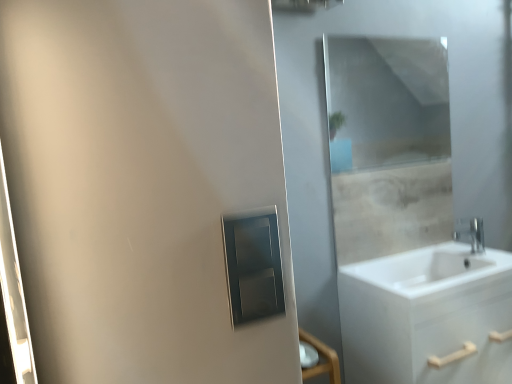
This screenshot has width=512, height=384. What are the coordinates of `silver metallic faucet at right` in the screenshot? It's located at (470, 233).

You are a GUI agent. You are given a task and a screenshot of the screen. Output one action in this format:
    pyautogui.click(x=<x>, y=<y>)
    Task: Click on the clear glass mirror at upper center
    Image resolution: width=512 pixels, height=384 pixels.
    Given the screenshot: What is the action you would take?
    [x=386, y=101]

What do you see at coordinates (253, 266) in the screenshot?
I see `matte silver medicine cabinet at center` at bounding box center [253, 266].

This screenshot has width=512, height=384. What are the coordinates of `matte silver medicine cabinet at center` in the screenshot? It's located at (253, 266).

Locate an element on the screen. The height and width of the screenshot is (384, 512). white matte cabinet at lower right is located at coordinates (428, 316).

Looking at this image, considering the relative sizes of matte silver medicine cabinet at center and silver metallic faucet at right in the image provided, is matte silver medicine cabinet at center smaller than silver metallic faucet at right?

Indeed, matte silver medicine cabinet at center has a smaller size compared to silver metallic faucet at right.

Locate an element on the screen. medicine cabinet that appears above the silver metallic faucet at right (from a real-world perspective) is located at coordinates (253, 266).

Would you say silver metallic faucet at right is part of matte silver medicine cabinet at center's contents?

No.

Considering their positions, is white matte cabinet at lower right located in front of or behind clear glass mirror at upper center?

Visually, white matte cabinet at lower right is located in front of clear glass mirror at upper center.

From the image's perspective, is white matte cabinet at lower right over clear glass mirror at upper center?

No, from the image's perspective, white matte cabinet at lower right is not over clear glass mirror at upper center.

Is the surface of white matte cabinet at lower right in direct contact with clear glass mirror at upper center?

No, white matte cabinet at lower right is not next to clear glass mirror at upper center.

Could you tell me if white matte cabinet at lower right is turned towards clear glass mirror at upper center?

No, white matte cabinet at lower right does not turn towards clear glass mirror at upper center.

Is point (462, 234) farther from viewer compared to point (359, 151)?

No, (462, 234) is in front of (359, 151).

Is silver metallic faucet at right inside or outside of clear glass mirror at upper center?

silver metallic faucet at right is outside clear glass mirror at upper center.

Between silver metallic faucet at right and clear glass mirror at upper center, which one has more height?

Standing taller between the two is clear glass mirror at upper center.

Considering the positions of objects silver metallic faucet at right and clear glass mirror at upper center in the image provided, who is in front, silver metallic faucet at right or clear glass mirror at upper center?

clear glass mirror at upper center is closer to the camera.

Which of these two, clear glass mirror at upper center or silver metallic faucet at right, is smaller?

With smaller size is silver metallic faucet at right.

Which is nearer, (344, 65) or (459, 222)?

Clearly, point (344, 65) is more distant from the camera than point (459, 222).

Can you confirm if clear glass mirror at upper center is thinner than silver metallic faucet at right?

Indeed, clear glass mirror at upper center has a lesser width compared to silver metallic faucet at right.

Is silver metallic faucet at right bigger than white matte cabinet at lower right?

No, silver metallic faucet at right is not bigger than white matte cabinet at lower right.

Which object is more forward, silver metallic faucet at right or white matte cabinet at lower right?

white matte cabinet at lower right is closer to the camera.

Can we say silver metallic faucet at right lies outside white matte cabinet at lower right?

Absolutely, silver metallic faucet at right is external to white matte cabinet at lower right.

Measure the distance from silver metallic faucet at right to white matte cabinet at lower right.

The distance of silver metallic faucet at right from white matte cabinet at lower right is 16.52 inches.

From a real-world perspective, does matte silver medicine cabinet at center stand above clear glass mirror at upper center?

No.

From the image's perspective, is matte silver medicine cabinet at center below clear glass mirror at upper center?

Yes.

Between matte silver medicine cabinet at center and clear glass mirror at upper center, which one has larger width?

clear glass mirror at upper center is wider.

Is matte silver medicine cabinet at center looking in the opposite direction of clear glass mirror at upper center?

No, clear glass mirror at upper center is not at the back of matte silver medicine cabinet at center.

This screenshot has width=512, height=384. Find the location of `bathroom cabinet to the right of matte silver medicine cabinet at center`. bathroom cabinet to the right of matte silver medicine cabinet at center is located at coordinates (428, 316).

Between matte silver medicine cabinet at center and white matte cabinet at lower right, which one appears on the right side from the viewer's perspective?

white matte cabinet at lower right is more to the right.

Considering the sizes of objects matte silver medicine cabinet at center and white matte cabinet at lower right in the image provided, who is bigger, matte silver medicine cabinet at center or white matte cabinet at lower right?

With larger size is white matte cabinet at lower right.

Looking at their sizes, would you say matte silver medicine cabinet at center is wider or thinner than white matte cabinet at lower right?

matte silver medicine cabinet at center is thinner than white matte cabinet at lower right.

The width and height of the screenshot is (512, 384). Find the location of `medicine cabinet on the left of silver metallic faucet at right`. medicine cabinet on the left of silver metallic faucet at right is located at coordinates (253, 266).

What are the coordinates of `bathroom cabinet in front of the clear glass mirror at upper center` in the screenshot? It's located at (428, 316).

From the image, which object appears to be nearer to white matte cabinet at lower right, matte silver medicine cabinet at center or clear glass mirror at upper center?

The object closer to white matte cabinet at lower right is matte silver medicine cabinet at center.

Based on the photo, when comparing their distances from white matte cabinet at lower right, does matte silver medicine cabinet at center or silver metallic faucet at right seem closer?

Among the two, silver metallic faucet at right is located nearer to white matte cabinet at lower right.

Which object lies nearer to the anchor point clear glass mirror at upper center, silver metallic faucet at right or matte silver medicine cabinet at center?

silver metallic faucet at right lies closer to clear glass mirror at upper center than the other object.

Based on their spatial positions, is silver metallic faucet at right or clear glass mirror at upper center closer to matte silver medicine cabinet at center?

silver metallic faucet at right is closer to matte silver medicine cabinet at center.

Looking at the image, which one is located further to white matte cabinet at lower right, silver metallic faucet at right or clear glass mirror at upper center?

The object further to white matte cabinet at lower right is clear glass mirror at upper center.

Looking at the image, which one is located further to matte silver medicine cabinet at center, white matte cabinet at lower right or clear glass mirror at upper center?

clear glass mirror at upper center lies further to matte silver medicine cabinet at center than the other object.

Looking at the image, which one is located closer to clear glass mirror at upper center, white matte cabinet at lower right or matte silver medicine cabinet at center?

white matte cabinet at lower right is closer to clear glass mirror at upper center.

Estimate the real-world distances between objects in this image. Which object is closer to clear glass mirror at upper center, matte silver medicine cabinet at center or white matte cabinet at lower right?

Based on the image, white matte cabinet at lower right appears to be nearer to clear glass mirror at upper center.

The width and height of the screenshot is (512, 384). In order to click on mirror between matte silver medicine cabinet at center and silver metallic faucet at right from front to back in this screenshot , I will do `click(386, 101)`.

At what (x,y) coordinates should I click in order to perform the action: click on tap between clear glass mirror at upper center and white matte cabinet at lower right from top to bottom. Please return your answer as a coordinate pair (x, y). Looking at the image, I should click on (470, 233).

Locate an element on the screen. bathroom cabinet positioned between matte silver medicine cabinet at center and clear glass mirror at upper center from near to far is located at coordinates (428, 316).

Where is `bathroom cabinet positioned between matte silver medicine cabinet at center and silver metallic faucet at right from near to far`? This screenshot has height=384, width=512. bathroom cabinet positioned between matte silver medicine cabinet at center and silver metallic faucet at right from near to far is located at coordinates [428, 316].